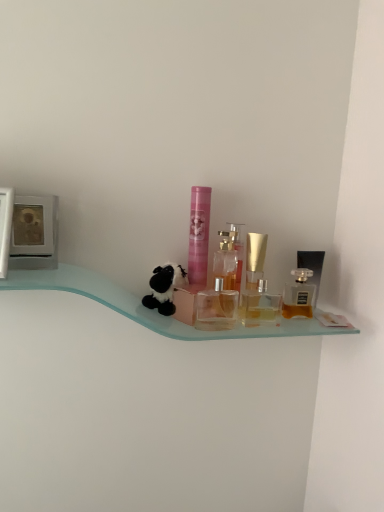
Question: Should I look upward or downward to see golden glass perfume at right, the 3th perfume viewed from the left?

Choices:
 (A) up
 (B) down

Answer: (B)

Question: Does golden glass perfume at right, placed as the 1th perfume when sorted from right to left, have a smaller size compared to translucent glass perfume bottle at right, the first toiletry from the right?

Choices:
 (A) yes
 (B) no

Answer: (A)

Question: From the image's perspective, is golden glass perfume at right, placed as the 1th perfume when sorted from right to left, below translucent glass perfume bottle at right, the first toiletry from the right?

Choices:
 (A) no
 (B) yes

Answer: (B)

Question: Is golden glass perfume at right, the 3th perfume viewed from the left, at the left side of translucent glass perfume bottle at right, the first toiletry from the right?

Choices:
 (A) yes
 (B) no

Answer: (A)

Question: Are golden glass perfume at right, placed as the 1th perfume when sorted from right to left, and translucent glass perfume bottle at right, marked as the third toiletry in a left-to-right arrangement, making contact?

Choices:
 (A) no
 (B) yes

Answer: (B)

Question: Considering the relative positions of golden glass perfume at right, the 3th perfume viewed from the left, and translucent glass perfume bottle at right, marked as the third toiletry in a left-to-right arrangement, in the image provided, is golden glass perfume at right, the 3th perfume viewed from the left, in front of translucent glass perfume bottle at right, marked as the third toiletry in a left-to-right arrangement,?

Choices:
 (A) no
 (B) yes

Answer: (B)

Question: Does golden glass perfume at right, the 3th perfume viewed from the left, have a larger size compared to translucent glass perfume bottle at right, the first toiletry from the right?

Choices:
 (A) no
 (B) yes

Answer: (A)

Question: Does pink matte tube at center, acting as the 1th toiletry starting from the left, turn towards black plush toy at center?

Choices:
 (A) yes
 (B) no

Answer: (B)

Question: From a real-world perspective, is pink matte tube at center, marked as the 3th toiletry in a right-to-left arrangement, over black plush toy at center?

Choices:
 (A) no
 (B) yes

Answer: (B)

Question: Is pink matte tube at center, marked as the 3th toiletry in a right-to-left arrangement, placed right next to black plush toy at center?

Choices:
 (A) yes
 (B) no

Answer: (A)

Question: Is pink matte tube at center, acting as the 1th toiletry starting from the left, far from black plush toy at center?

Choices:
 (A) no
 (B) yes

Answer: (A)

Question: Is black plush toy at center surrounded by pink matte tube at center, acting as the 1th toiletry starting from the left?

Choices:
 (A) no
 (B) yes

Answer: (A)

Question: Does pink matte tube at center, acting as the 1th toiletry starting from the left, have a larger size compared to black plush toy at center?

Choices:
 (A) no
 (B) yes

Answer: (A)

Question: Is pink matte tube at center, acting as the 1th toiletry starting from the left, far away from golden glass perfume at right, the 3th perfume viewed from the left?

Choices:
 (A) no
 (B) yes

Answer: (A)